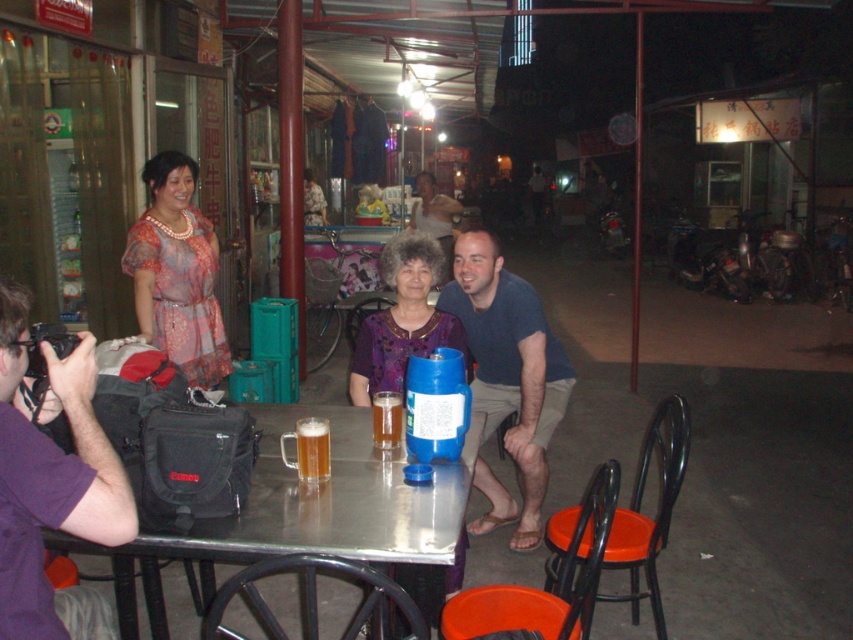
From the picture: Is translucent glass mug at center closer to camera compared to translucent glass mug at table center?

That is True.

Is translucent glass mug at center above translucent glass mug at table center?

No.

Who is more forward, (316, 451) or (393, 401)?

Point (316, 451)

Where is `translucent glass mug at center`? translucent glass mug at center is located at coordinates (309, 449).

Between metallic silver table at center and translucent glass mug at center, which one has more height?

With more height is metallic silver table at center.

Is metallic silver table at center smaller than translucent glass mug at center?

No, metallic silver table at center is not smaller than translucent glass mug at center.

Which is in front, point (123, 634) or point (297, 424)?

Point (297, 424) is in front.

At what (x,y) coordinates should I click in order to perform the action: click on metallic silver table at center. Please return your answer as a coordinate pair (x, y). Looking at the image, I should click on (318, 508).

Is point (537, 401) farther from viewer compared to point (386, 250)?

Yes, it is behind point (386, 250).

Which of these two, blue fabric shirt at center or purple fabric shirt at center, stands taller?

Standing taller between the two is blue fabric shirt at center.

Image resolution: width=853 pixels, height=640 pixels. Describe the element at coordinates (508, 378) in the screenshot. I see `blue fabric shirt at center` at that location.

Locate an element on the screen. The height and width of the screenshot is (640, 853). blue fabric shirt at center is located at coordinates (508, 378).